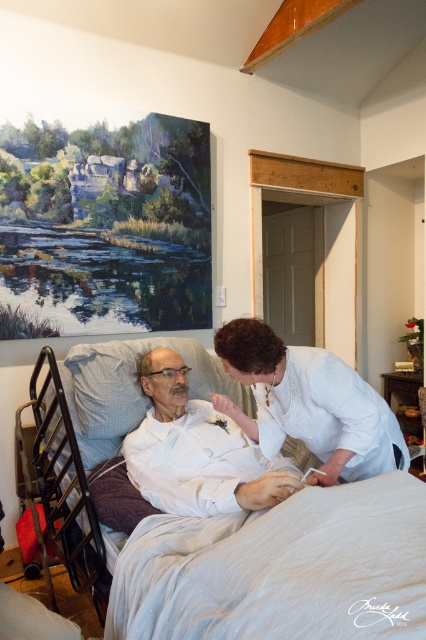
Can you confirm if white fabric bed at center is positioned below white satin blouse at center?

Yes, white fabric bed at center is below white satin blouse at center.

Who is lower down, white fabric bed at center or white satin blouse at center?

Positioned lower is white fabric bed at center.

The width and height of the screenshot is (426, 640). What do you see at coordinates (276, 568) in the screenshot? I see `white fabric bed at center` at bounding box center [276, 568].

At what (x,y) coordinates should I click in order to perform the action: click on white fabric bed at center. Please return your answer as a coordinate pair (x, y). Looking at the image, I should click on (276, 568).

Is white fabric bed at center shorter than white matte shirt at center?

No.

Does point (328, 509) lie behind point (273, 467)?

No, it is in front of (273, 467).

Is point (163, 342) farther from camera compared to point (166, 406)?

That is True.

Identify the location of white fabric bed at center. This screenshot has height=640, width=426. (276, 568).

Who is positioned more to the left, white satin blouse at center or white matte shirt at center?

→ white matte shirt at center is more to the left.

Which is behind, point (305, 429) or point (204, 449)?

Positioned behind is point (204, 449).

Locate an element on the screen. Image resolution: width=426 pixels, height=640 pixels. white satin blouse at center is located at coordinates (308, 403).